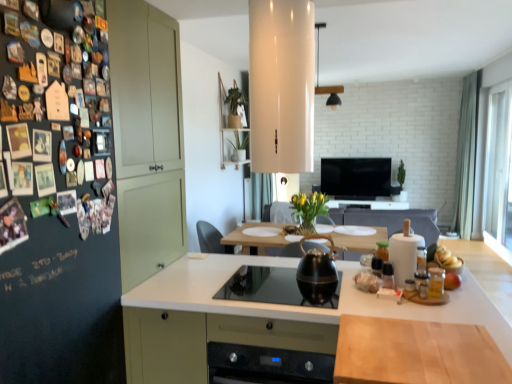
Question: Is shiny black kettle at center positioned before yellow matte bananas at right, which is counted as the second food, starting from the front?

Choices:
 (A) yes
 (B) no

Answer: (A)

Question: From the image's perspective, is shiny black kettle at center over yellow matte bananas at right, marked as the 1th food in a top-to-bottom arrangement?

Choices:
 (A) yes
 (B) no

Answer: (B)

Question: From a real-world perspective, does shiny black kettle at center stand above yellow matte bananas at right, marked as the 1th food in a top-to-bottom arrangement?

Choices:
 (A) yes
 (B) no

Answer: (A)

Question: Considering the relative sizes of shiny black kettle at center and yellow matte bananas at right, which is counted as the second food, starting from the front, in the image provided, is shiny black kettle at center bigger than yellow matte bananas at right, which is counted as the second food, starting from the front,?

Choices:
 (A) no
 (B) yes

Answer: (B)

Question: Does shiny black kettle at center contain yellow matte bananas at right, which is counted as the second food, starting from the front?

Choices:
 (A) yes
 (B) no

Answer: (B)

Question: Looking at their shapes, would you say dark matte board at left is wider or thinner than yellow matte bananas at right, which ranks as the 2th food in bottom-to-top order?

Choices:
 (A) thin
 (B) wide

Answer: (B)

Question: Considering the positions of dark matte board at left and yellow matte bananas at right, marked as the 1th food in a top-to-bottom arrangement, in the image, is dark matte board at left taller or shorter than yellow matte bananas at right, marked as the 1th food in a top-to-bottom arrangement,?

Choices:
 (A) tall
 (B) short

Answer: (A)

Question: Is dark matte board at left bigger or smaller than yellow matte bananas at right, which ranks as the 2th food in bottom-to-top order?

Choices:
 (A) small
 (B) big

Answer: (B)

Question: Considering the positions of point (1, 263) and point (443, 248), is point (1, 263) closer or farther from the camera than point (443, 248)?

Choices:
 (A) farther
 (B) closer

Answer: (B)

Question: From a real-world perspective, is transparent glass window at right physically located above or below shiny black kettle at center?

Choices:
 (A) below
 (B) above

Answer: (B)

Question: Considering the positions of transparent glass window at right and shiny black kettle at center in the image, is transparent glass window at right bigger or smaller than shiny black kettle at center?

Choices:
 (A) small
 (B) big

Answer: (B)

Question: From the image's perspective, relative to shiny black kettle at center, is transparent glass window at right above or below?

Choices:
 (A) above
 (B) below

Answer: (A)

Question: Looking at their shapes, would you say transparent glass window at right is wider or thinner than shiny black kettle at center?

Choices:
 (A) wide
 (B) thin

Answer: (B)

Question: In the image, is yellow matte bananas at right, which ranks as the first food in back-to-front order, on the left side or the right side of transparent glass window at right?

Choices:
 (A) left
 (B) right

Answer: (A)

Question: Is point (444, 258) closer or farther from the camera than point (509, 160)?

Choices:
 (A) farther
 (B) closer

Answer: (B)